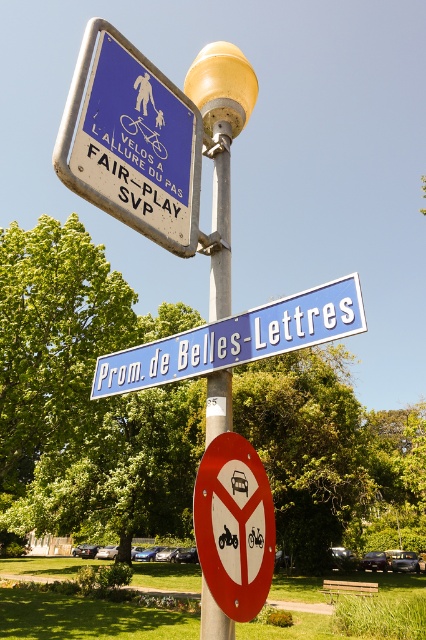
Question: Which object is positioned farthest from the yellow plastic lamp post at center?

Choices:
 (A) blue plastic sign at upper left
 (B) silver metallic pole at center
 (C) blue plastic street sign at center
 (D) red plastic sign at lower center

Answer: (B)

Question: Which point is closer to the camera?

Choices:
 (A) 230,483
 (B) 189,140
 (C) 244,64

Answer: (A)

Question: Among these objects, which one is nearest to the camera?

Choices:
 (A) blue plastic street sign at center
 (B) silver metallic pole at center

Answer: (B)

Question: Does blue plastic street sign at center appear under yellow plastic lamp post at center?

Choices:
 (A) yes
 (B) no

Answer: (A)

Question: Is blue plastic sign at upper left closer to the viewer compared to blue plastic street sign at center?

Choices:
 (A) yes
 (B) no

Answer: (A)

Question: Can you confirm if blue plastic street sign at center is thinner than silver metallic pole at center?

Choices:
 (A) no
 (B) yes

Answer: (A)